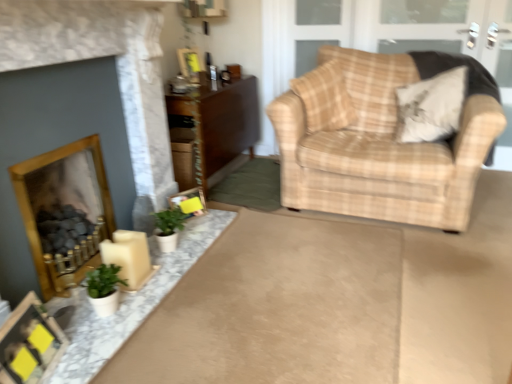
Question: Is green matte plant at lower left, which is counted as the 2th houseplant, starting from the back, shorter than matte gold fireplace at left, which ranks as the first fireplace in front-to-back order?

Choices:
 (A) no
 (B) yes

Answer: (B)

Question: Is green matte plant at lower left, which is counted as the 2th houseplant, starting from the back, directly adjacent to matte gold fireplace at left, which ranks as the first fireplace in front-to-back order?

Choices:
 (A) yes
 (B) no

Answer: (B)

Question: Can you confirm if green matte plant at lower left, which is counted as the 2th houseplant, starting from the back, is taller than matte gold fireplace at left, placed as the 2th fireplace when sorted from back to front?

Choices:
 (A) yes
 (B) no

Answer: (B)

Question: From the image's perspective, is green matte plant at lower left, which appears as the first houseplant when viewed from the front, over matte gold fireplace at left, which ranks as the first fireplace in front-to-back order?

Choices:
 (A) no
 (B) yes

Answer: (A)

Question: Considering the relative sizes of green matte plant at lower left, which is counted as the 2th houseplant, starting from the back, and matte gold fireplace at left, which ranks as the first fireplace in front-to-back order, in the image provided, is green matte plant at lower left, which is counted as the 2th houseplant, starting from the back, smaller than matte gold fireplace at left, which ranks as the first fireplace in front-to-back order,?

Choices:
 (A) yes
 (B) no

Answer: (A)

Question: Is green matte plant at lower left, which appears as the first houseplant when viewed from the front, to the left of matte gold fireplace at left, which ranks as the first fireplace in front-to-back order, from the viewer's perspective?

Choices:
 (A) no
 (B) yes

Answer: (A)

Question: Considering the relative sizes of beige fabric pillow at upper right, the 2th pillow when ordered from left to right, and wooden fireplace at lower left, the 2th fireplace viewed from the front, in the image provided, is beige fabric pillow at upper right, the 2th pillow when ordered from left to right, shorter than wooden fireplace at lower left, the 2th fireplace viewed from the front,?

Choices:
 (A) yes
 (B) no

Answer: (A)

Question: Can you confirm if beige fabric pillow at upper right, the 1th pillow viewed from the right, is smaller than wooden fireplace at lower left, the first fireplace from the back?

Choices:
 (A) yes
 (B) no

Answer: (A)

Question: From the image's perspective, would you say beige fabric pillow at upper right, the 1th pillow viewed from the right, is positioned over wooden fireplace at lower left, the first fireplace from the back?

Choices:
 (A) yes
 (B) no

Answer: (A)

Question: From a real-world perspective, is beige fabric pillow at upper right, the 1th pillow viewed from the right, under wooden fireplace at lower left, the first fireplace from the back?

Choices:
 (A) no
 (B) yes

Answer: (A)

Question: Does beige fabric pillow at upper right, the 2th pillow when ordered from left to right, appear on the left side of wooden fireplace at lower left, the first fireplace from the back?

Choices:
 (A) no
 (B) yes

Answer: (A)

Question: From a real-world perspective, is beige fabric pillow at upper right, the 2th pillow when ordered from left to right, over wooden fireplace at lower left, the first fireplace from the back?

Choices:
 (A) no
 (B) yes

Answer: (B)

Question: Considering the relative sizes of green matte plant at lower left, which is counted as the 1th houseplant, starting from the back, and beige plaid armchair at right in the image provided, is green matte plant at lower left, which is counted as the 1th houseplant, starting from the back, thinner than beige plaid armchair at right?

Choices:
 (A) no
 (B) yes

Answer: (B)